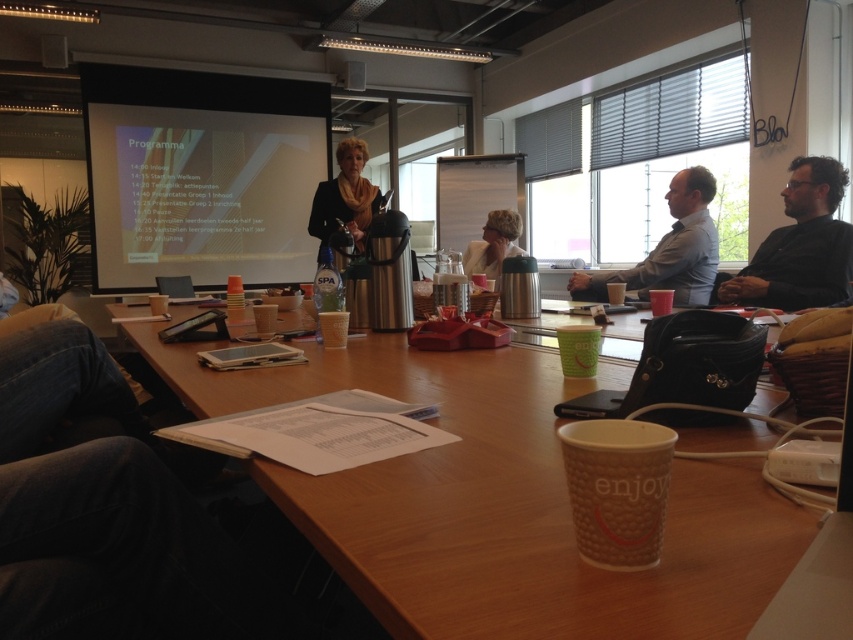
You are standing in the office and want to reach the point at coordinates point (x=788, y=568). If your arm can reach up to 16 inches, can you reach it without moving closer?

The distance of point (x=788, y=568) from viewer is 18.04 inches, so you cannot reach it with an arm length of 16 inches.

You are attending a meeting and see the matte blue shirt at upper right and the black fabric jacket at center. Which one is more to the right?

The matte blue shirt at upper right is more to the right than the black fabric jacket at center.